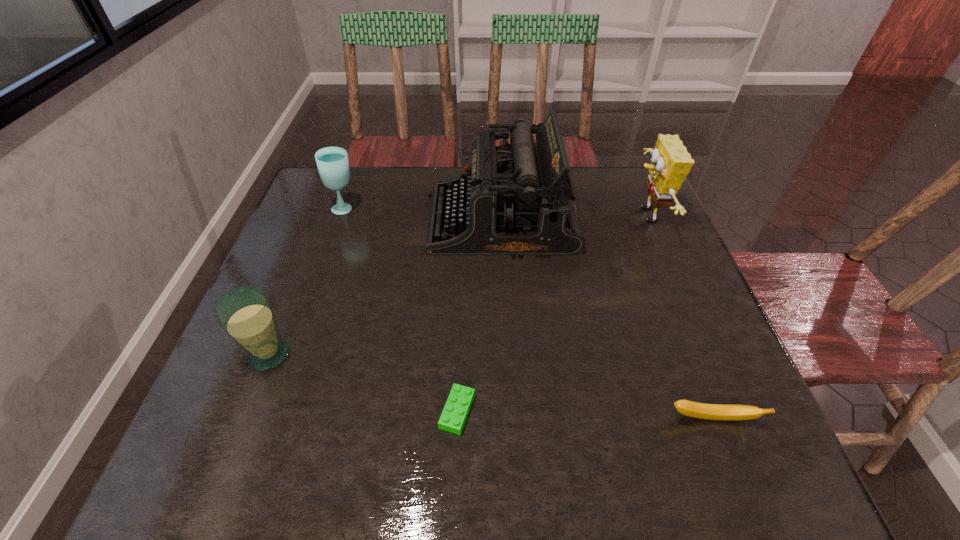
This screenshot has height=540, width=960. Find the location of `free space located 0.250m on the face of the second tallest object`. free space located 0.250m on the face of the second tallest object is located at coordinates (539, 216).

Where is `vacant position located on the face of the second tallest object`? vacant position located on the face of the second tallest object is located at coordinates (503, 216).

The width and height of the screenshot is (960, 540). What are the coordinates of `vacant space located on the right of the farther glass` in the screenshot? It's located at (409, 208).

This screenshot has width=960, height=540. In order to click on free location located on the back of the nearer glass in this screenshot , I will do `click(320, 226)`.

In order to click on vacant region located on the right of the shortest object in this screenshot , I will do `click(636, 411)`.

This screenshot has width=960, height=540. I want to click on typewriter situated at the far edge, so click(x=515, y=199).

Where is `sponge located in the far edge section of the desktop`? This screenshot has height=540, width=960. sponge located in the far edge section of the desktop is located at coordinates (670, 163).

Locate an element on the screen. glass located at the far edge is located at coordinates (332, 162).

The height and width of the screenshot is (540, 960). I want to click on object that is at the near edge, so click(x=455, y=412).

This screenshot has height=540, width=960. In order to click on sponge located in the right edge section of the desktop in this screenshot , I will do `click(670, 163)`.